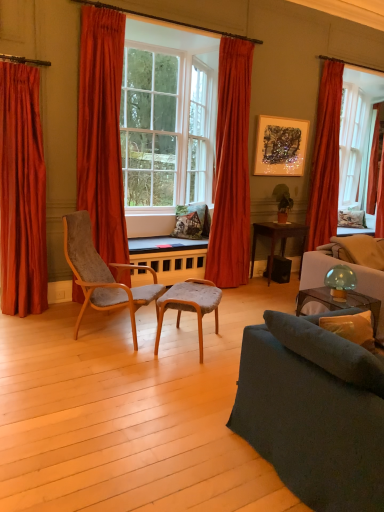
Question: Is velvet orange curtain at left, the 4th curtain when ordered from right to left, looking in the opposite direction of metallic textured artwork at upper center?

Choices:
 (A) no
 (B) yes

Answer: (A)

Question: Does velvet orange curtain at left, which is the 2th curtain in left-to-right order, have a greater width compared to metallic textured artwork at upper center?

Choices:
 (A) no
 (B) yes

Answer: (B)

Question: Can you confirm if velvet orange curtain at left, which is the 2th curtain in left-to-right order, is taller than metallic textured artwork at upper center?

Choices:
 (A) no
 (B) yes

Answer: (B)

Question: From the image's perspective, is velvet orange curtain at left, the 4th curtain when ordered from right to left, beneath metallic textured artwork at upper center?

Choices:
 (A) yes
 (B) no

Answer: (A)

Question: Could you tell me if velvet orange curtain at left, the 4th curtain when ordered from right to left, is facing metallic textured artwork at upper center?

Choices:
 (A) no
 (B) yes

Answer: (A)

Question: Is point (327, 248) closer or farther from the camera than point (319, 330)?

Choices:
 (A) closer
 (B) farther

Answer: (B)

Question: In terms of width, does velvet blue couch at right look wider or thinner when compared to dark gray fabric couch at lower right?

Choices:
 (A) thin
 (B) wide

Answer: (B)

Question: From a real-world perspective, is velvet blue couch at right positioned above or below dark gray fabric couch at lower right?

Choices:
 (A) below
 (B) above

Answer: (A)

Question: Is velvet blue couch at right taller or shorter than dark gray fabric couch at lower right?

Choices:
 (A) tall
 (B) short

Answer: (B)

Question: In terms of height, does white fabric pillow at upper right, which appears as the second pillow when viewed from the left, look taller or shorter compared to dark gray fabric couch at lower right?

Choices:
 (A) short
 (B) tall

Answer: (A)

Question: Looking at the image, does white fabric pillow at upper right, the 2th pillow from the front, seem bigger or smaller compared to dark gray fabric couch at lower right?

Choices:
 (A) small
 (B) big

Answer: (A)

Question: From the image's perspective, is white fabric pillow at upper right, arranged as the 1th pillow when viewed from the top, positioned above or below dark gray fabric couch at lower right?

Choices:
 (A) below
 (B) above

Answer: (B)

Question: Relative to dark gray fabric couch at lower right, is white fabric pillow at upper right, which is counted as the 2th pillow, starting from the bottom, in front or behind?

Choices:
 (A) behind
 (B) front

Answer: (A)

Question: Would you say wooden table at center, the second table from the right, is to the left or to the right of white fabric pillow at upper right, acting as the 1th pillow starting from the back, in the picture?

Choices:
 (A) left
 (B) right

Answer: (A)

Question: From the image's perspective, is wooden table at center, positioned as the first table in left-to-right order, positioned above or below white fabric pillow at upper right, which is the first pillow in right-to-left order?

Choices:
 (A) above
 (B) below

Answer: (B)